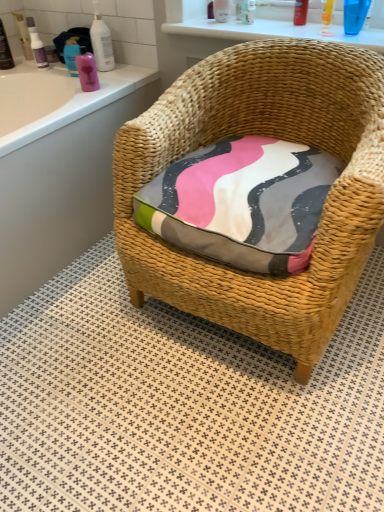
I want to click on vacant space in between translucent plastic bottle at upper center, the 3th toiletry viewed from the right, and translucent plastic bottle at upper center, acting as the second toiletry starting from the right, so click(x=272, y=23).